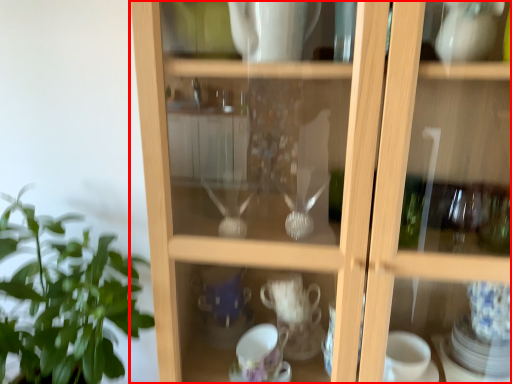
Question: Where is cupboard (annotated by the red box) located in relation to houseplant in the image?

Choices:
 (A) right
 (B) left

Answer: (A)